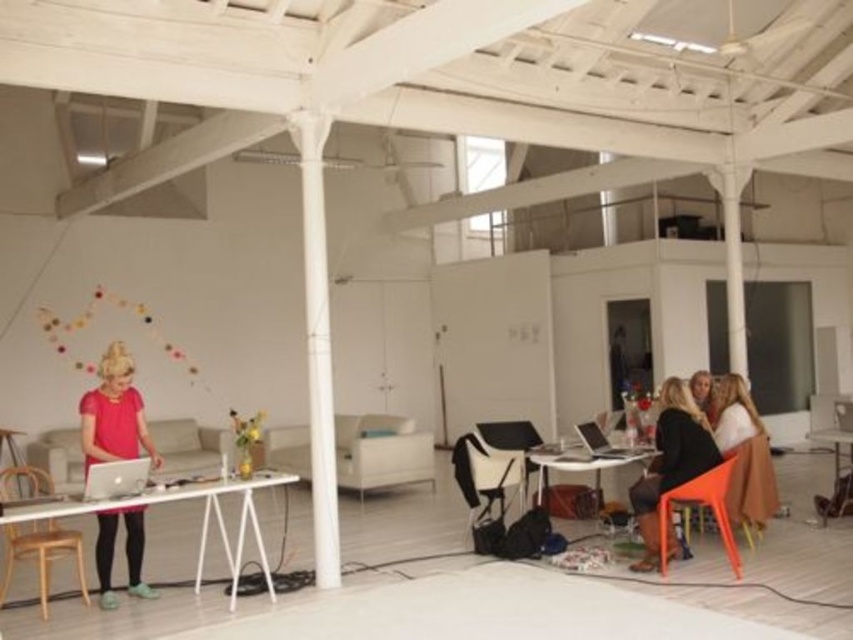
You are standing at the point labeled point (727, 522) and want to walk to the exit located at point (654, 467). Is the exit directly in front of you or behind you?

The exit at point (654, 467) is behind point (727, 522), so the exit is behind you.